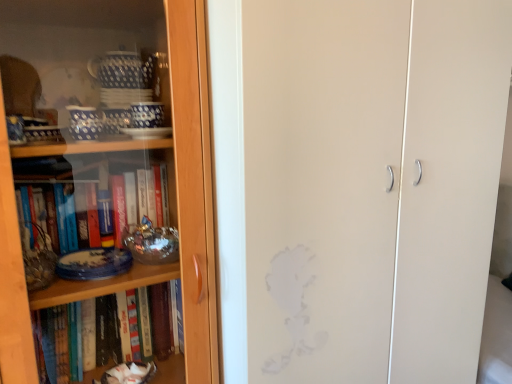
Question: Can you confirm if matte white cabinet at center is positioned to the right of wooden bookcase at left?

Choices:
 (A) yes
 (B) no

Answer: (A)

Question: Is matte white cabinet at center at the left side of wooden bookcase at left?

Choices:
 (A) no
 (B) yes

Answer: (A)

Question: Is matte white cabinet at center wider than wooden bookcase at left?

Choices:
 (A) yes
 (B) no

Answer: (A)

Question: Is matte white cabinet at center positioned beyond the bounds of wooden bookcase at left?

Choices:
 (A) yes
 (B) no

Answer: (A)

Question: Is matte white cabinet at center closer to camera compared to wooden bookcase at left?

Choices:
 (A) yes
 (B) no

Answer: (B)

Question: Is matte white cabinet at center far from wooden bookcase at left?

Choices:
 (A) no
 (B) yes

Answer: (A)

Question: Could you tell me if wooden bookcase at left is turned towards matte white cabinet at center?

Choices:
 (A) yes
 (B) no

Answer: (B)

Question: Does wooden bookcase at left appear on the left side of matte white cabinet at center?

Choices:
 (A) no
 (B) yes

Answer: (B)

Question: Does wooden bookcase at left appear on the right side of matte white cabinet at center?

Choices:
 (A) yes
 (B) no

Answer: (B)

Question: From a real-world perspective, is wooden bookcase at left below matte white cabinet at center?

Choices:
 (A) no
 (B) yes

Answer: (A)

Question: Considering the relative sizes of wooden bookcase at left and matte white cabinet at center in the image provided, is wooden bookcase at left taller than matte white cabinet at center?

Choices:
 (A) no
 (B) yes

Answer: (A)

Question: Does wooden bookcase at left have a lesser height compared to matte white cabinet at center?

Choices:
 (A) yes
 (B) no

Answer: (A)

Question: Is wooden bookcase at left situated inside matte white cabinet at center or outside?

Choices:
 (A) outside
 (B) inside

Answer: (A)